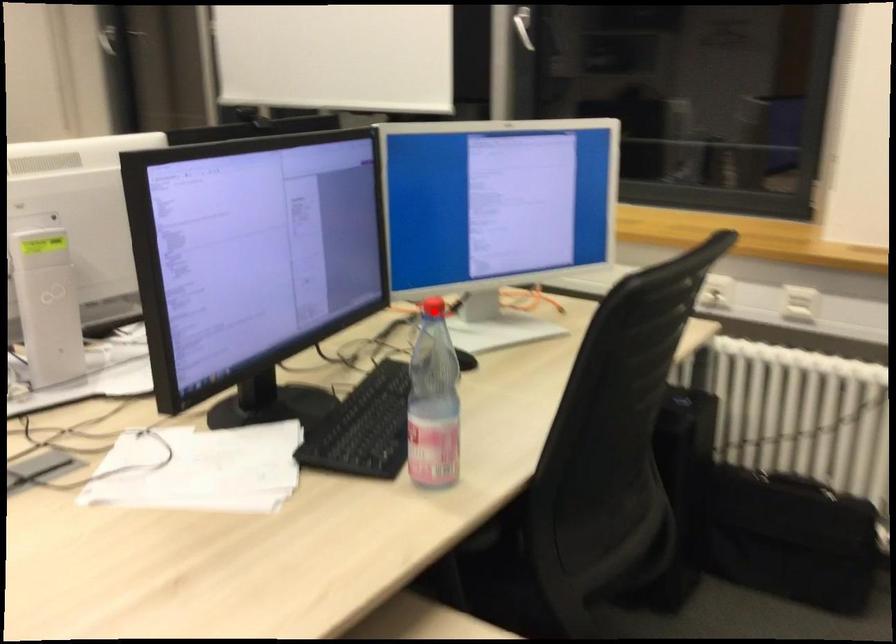
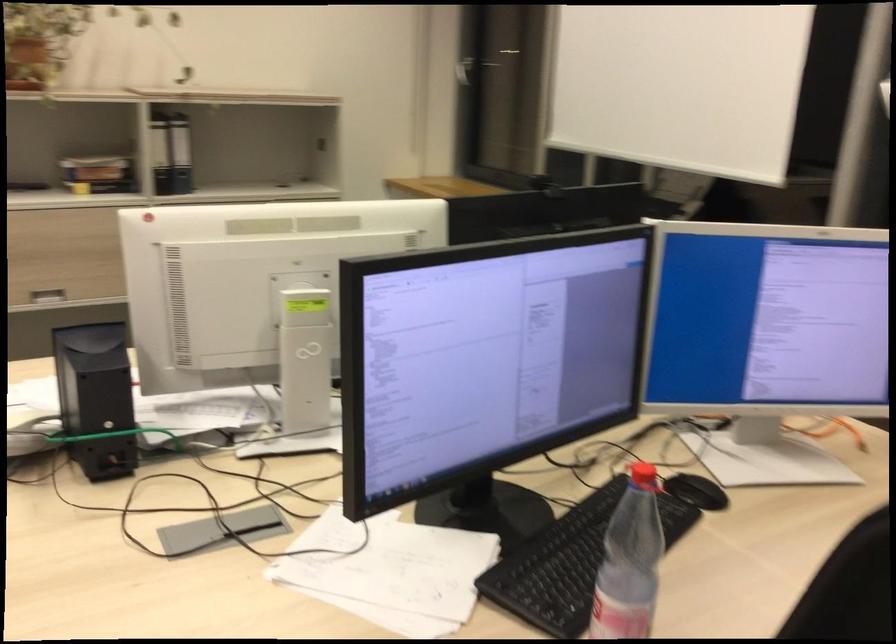
Question: I am providing you with two images of the same scene from different viewpoints. A red point is shown in image1. For the corresponding object point in image2, is it positioned nearer or farther from the camera?

Choices:
 (A) Nearer
 (B) Farther

Answer: (A)